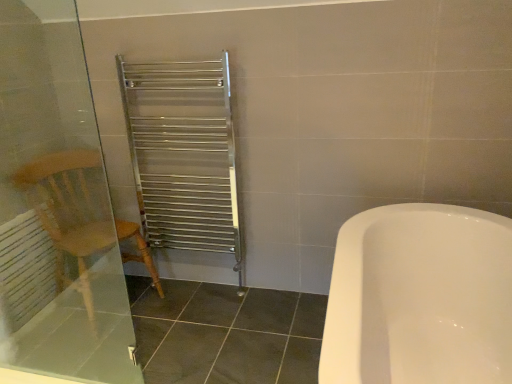
Locate an element on the screen. Image resolution: width=512 pixels, height=384 pixels. wooden armchair at left is located at coordinates (78, 214).

What is the approximate width of transparent glass screen door at left?

transparent glass screen door at left is 1.74 inches wide.

Measure the distance between point (29,278) and camera.

Point (29,278) and camera are 7.24 feet apart.

Locate an element on the screen. wooden armchair at left is located at coordinates (78, 214).

From a real-world perspective, is wooden armchair at left below white matte radiator at left?

No, from a real-world perspective, wooden armchair at left is not beneath white matte radiator at left.

From the image's perspective, is wooden armchair at left located above or below white matte radiator at left?

Based on their image positions, wooden armchair at left is located above white matte radiator at left.

Can you confirm if wooden armchair at left is positioned to the right of white matte radiator at left?

Yes, wooden armchair at left is to the right of white matte radiator at left.

I want to click on radiator to the left of transparent glass screen door at left, so click(x=25, y=269).

Can you tell me how much white matte radiator at left and transparent glass screen door at left differ in facing direction?

88 degrees.

From a real-world perspective, is white matte radiator at left located higher than transparent glass screen door at left?

No, from a real-world perspective, white matte radiator at left is not on top of transparent glass screen door at left.

How different are the orientations of white matte radiator at left and wooden armchair at left in degrees?

The angular difference between white matte radiator at left and wooden armchair at left is 19.9 degrees.

Consider the image. Would you say white matte radiator at left is a long distance from wooden armchair at left?

white matte radiator at left is actually quite close to wooden armchair at left.

Is wooden armchair at left completely or partially inside white matte radiator at left?

No, wooden armchair at left is not inside white matte radiator at left.

Between white matte radiator at left and wooden armchair at left, which one has more height?

With more height is wooden armchair at left.

Does point (37, 320) come behind point (9, 249)?

Yes, it is.

How different are the orientations of transparent glass screen door at left and white matte radiator at left in degrees?

→ transparent glass screen door at left and white matte radiator at left are facing 88 degrees away from each other.

Who is shorter, transparent glass screen door at left or white matte radiator at left?

white matte radiator at left is shorter.

From the picture: Between transparent glass screen door at left and white matte radiator at left, which one appears on the right side from the viewer's perspective?

transparent glass screen door at left is more to the right.

Is wooden armchair at left situated inside transparent glass screen door at left or outside?

wooden armchair at left is not enclosed by transparent glass screen door at left.

Which is farther, (86, 242) or (75, 256)?

Positioned behind is point (75, 256).

From a real-world perspective, relative to transparent glass screen door at left, is wooden armchair at left vertically above or below?

wooden armchair at left is situated lower than transparent glass screen door at left in the real world.

Looking at this image, does wooden armchair at left appear on the right side of transparent glass screen door at left?

In fact, wooden armchair at left is to the left of transparent glass screen door at left.

From a real-world perspective, between transparent glass screen door at left and wooden armchair at left, who is vertically lower?

In real-world perspective, wooden armchair at left is lower.

How different are the orientations of transparent glass screen door at left and wooden armchair at left in degrees?

They differ by 68.1 degrees in their facing directions.

Considering the relative sizes of transparent glass screen door at left and wooden armchair at left in the image provided, is transparent glass screen door at left smaller than wooden armchair at left?

Correct, transparent glass screen door at left occupies less space than wooden armchair at left.

In terms of height, does transparent glass screen door at left look taller or shorter compared to wooden armchair at left?

In the image, transparent glass screen door at left appears to be taller than wooden armchair at left.

The image size is (512, 384). In order to click on armchair lying in front of the white matte radiator at left in this screenshot , I will do `click(78, 214)`.

The height and width of the screenshot is (384, 512). I want to click on screen door that is above the white matte radiator at left (from a real-world perspective), so click(x=56, y=208).

Looking at the image, which one is located closer to white matte radiator at left, transparent glass screen door at left or wooden armchair at left?

Among the two, transparent glass screen door at left is located nearer to white matte radiator at left.

Looking at the image, which one is located closer to white matte radiator at left, wooden armchair at left or transparent glass screen door at left?

Among the two, transparent glass screen door at left is located nearer to white matte radiator at left.

Estimate the real-world distances between objects in this image. Which object is closer to transparent glass screen door at left, wooden armchair at left or white matte radiator at left?

wooden armchair at left.

Which object lies further to the anchor point transparent glass screen door at left, white matte radiator at left or wooden armchair at left?

Among the two, white matte radiator at left is located further to transparent glass screen door at left.

Which object lies further to the anchor point wooden armchair at left, white matte radiator at left or transparent glass screen door at left?

The object further to wooden armchair at left is white matte radiator at left.

Estimate the real-world distances between objects in this image. Which object is closer to wooden armchair at left, transparent glass screen door at left or white matte radiator at left?

transparent glass screen door at left lies closer to wooden armchair at left than the other object.

Locate an element on the screen. armchair located between transparent glass screen door at left and white matte radiator at left in the depth direction is located at coordinates (78, 214).